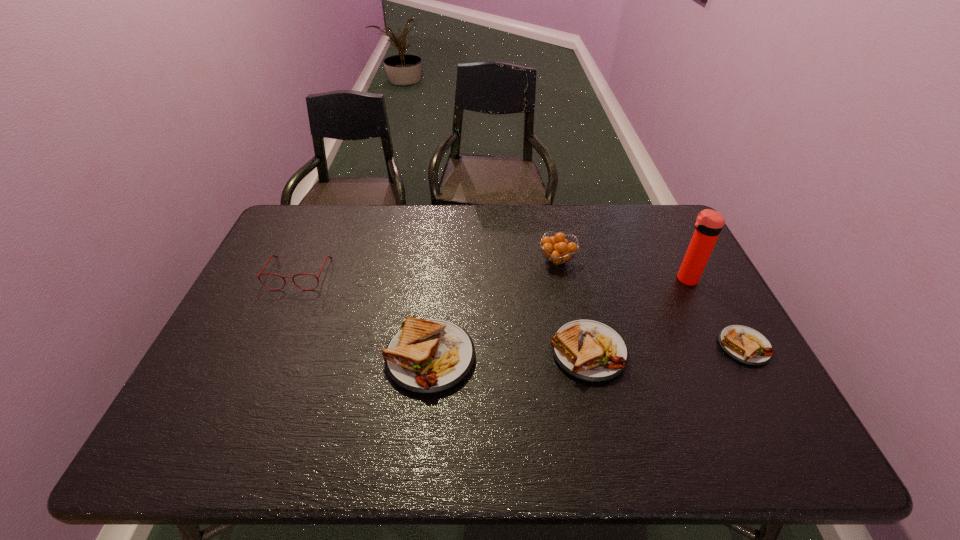
Identify the location of vacant spot to place a sandwich on the left. (267, 362).